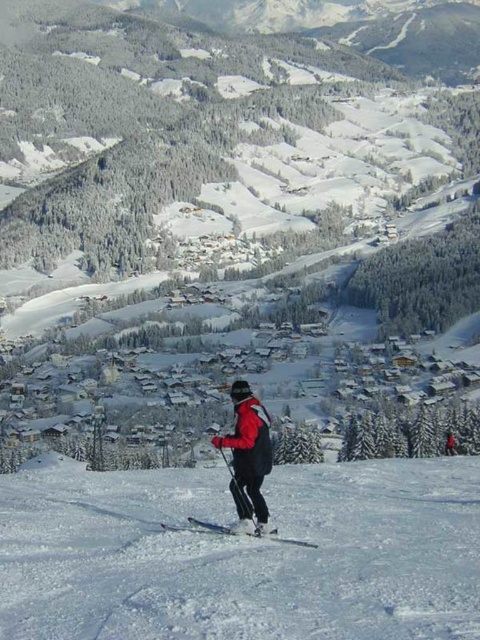
Question: Can you confirm if white snow ski slope at center is positioned below white plastic ski at center?

Choices:
 (A) no
 (B) yes

Answer: (B)

Question: Which point is closer to the camera?

Choices:
 (A) coord(107,492)
 (B) coord(245,518)

Answer: (B)

Question: Which object appears closest to the camera in this image?

Choices:
 (A) white plastic ski at center
 (B) red matte jacket at center

Answer: (B)

Question: Which object is the closest to the red matte jacket at center?

Choices:
 (A) white plastic ski at center
 (B) white snow ski slope at center

Answer: (B)

Question: Can you confirm if white snow ski slope at center is positioned to the left of red matte jacket at center?

Choices:
 (A) no
 (B) yes

Answer: (A)

Question: Can you confirm if white snow ski slope at center is thinner than white plastic ski at center?

Choices:
 (A) no
 (B) yes

Answer: (A)